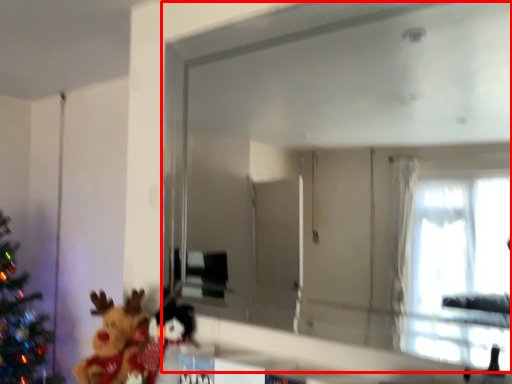
Question: In this image, where is mirror (annotated by the red box) located relative to toy?

Choices:
 (A) left
 (B) right

Answer: (B)